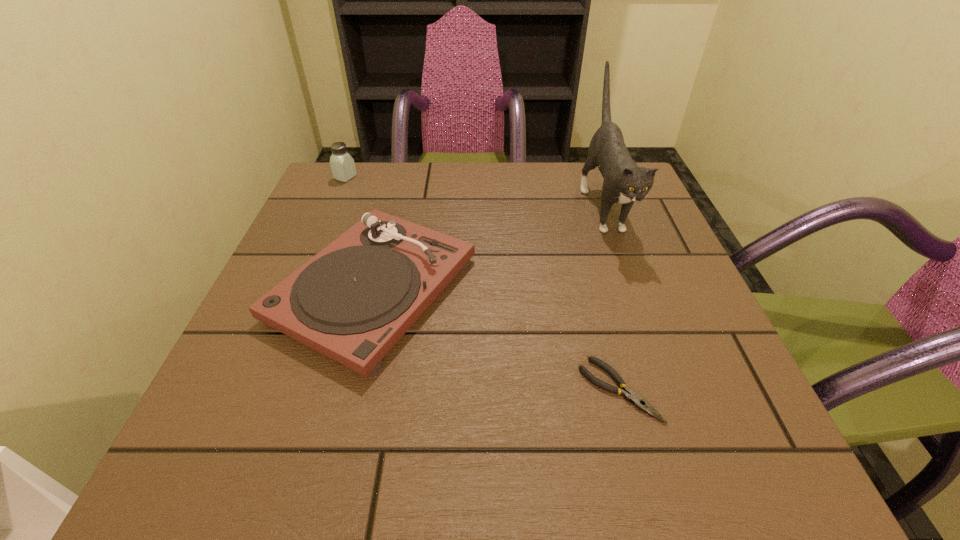
Where is `free space between the saltshaker and the shortest object`? free space between the saltshaker and the shortest object is located at coordinates (482, 284).

Locate an element on the screen. vacant area that lies between the saltshaker and the cat is located at coordinates (474, 191).

Find the location of a particular element. The image size is (960, 540). object that stands as the second closest to the saltshaker is located at coordinates (624, 182).

Choose which object is the third nearest neighbor to the pliers. Please provide its 2D coordinates. Your answer should be formatted as a tuple, i.e. [(x, y)], where the tuple contains the x and y coordinates of a point satisfying the conditions above.

[(342, 164)]

Where is `free space that satisfies the following two spatial constraints: 1. on the front side of the phonograph_record; 2. on the left side of the pliers`? This screenshot has width=960, height=540. free space that satisfies the following two spatial constraints: 1. on the front side of the phonograph_record; 2. on the left side of the pliers is located at coordinates (348, 390).